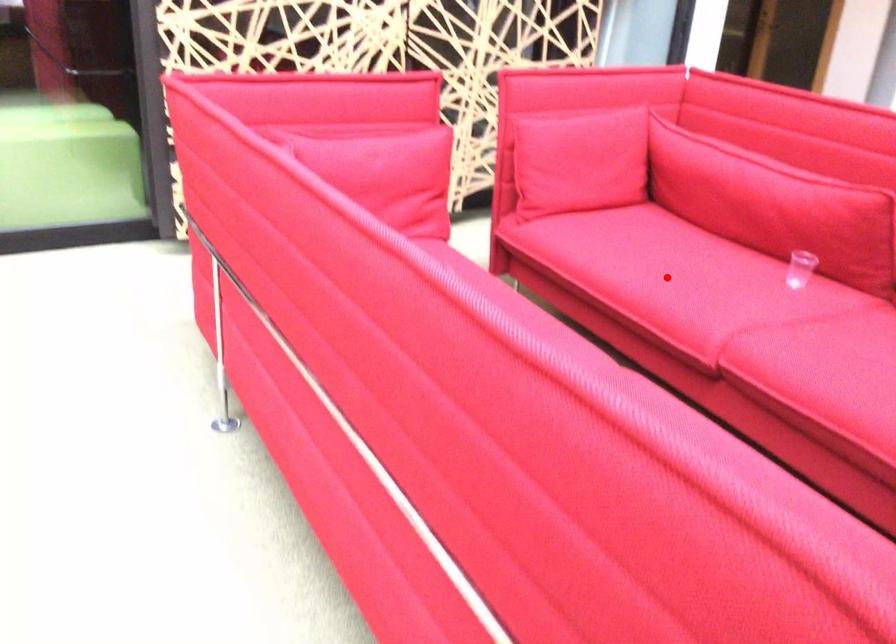
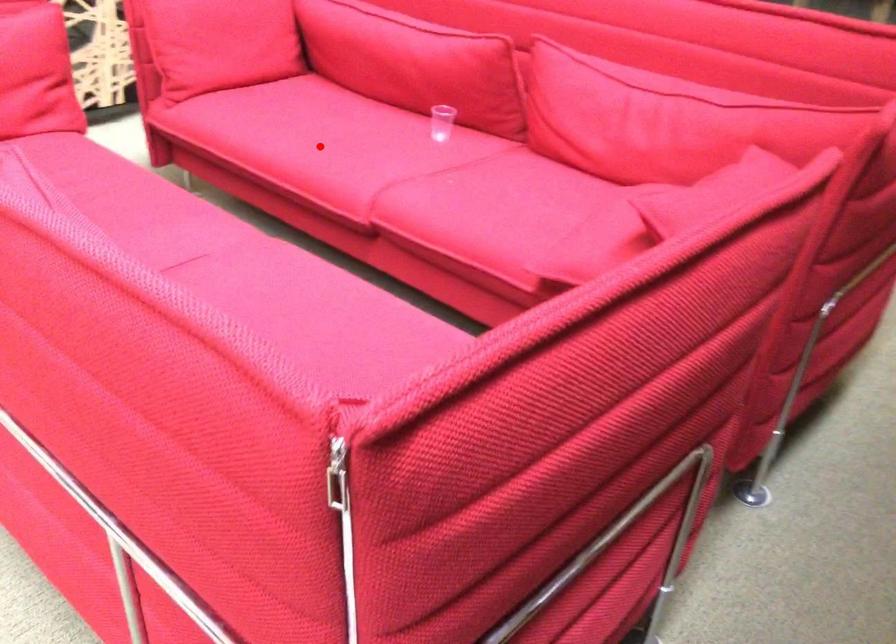
I am providing you with two images of the same scene from different viewpoints. A red point is marked on the first image and another point is marked on the second image. Is the red point in image1 aligned with the point shown in image2?

Yes